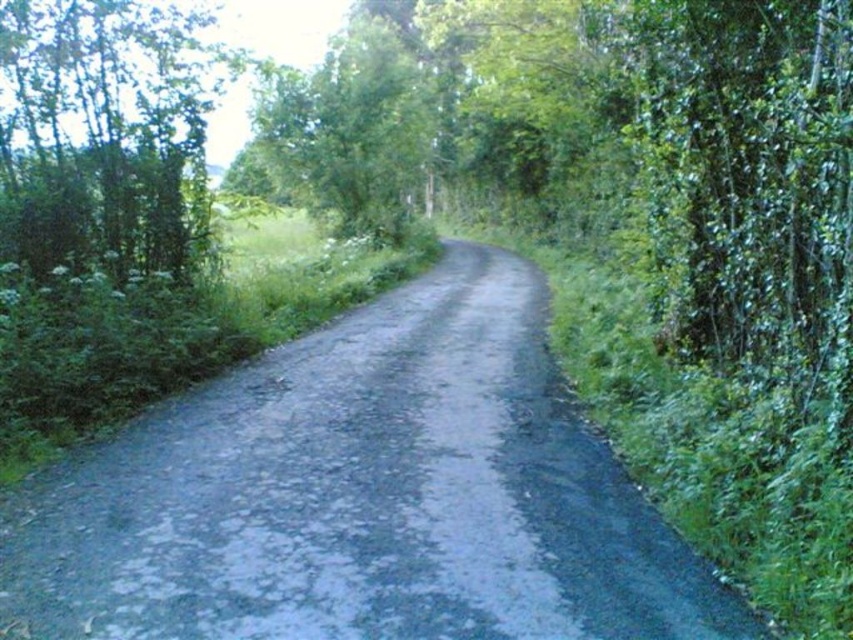
Question: Which point is farther from the camera taking this photo?

Choices:
 (A) (503, 580)
 (B) (157, 240)

Answer: (B)

Question: Can you confirm if gray asphalt road at center is positioned to the left of green leafy tree at left?

Choices:
 (A) yes
 (B) no

Answer: (B)

Question: Which of the following is the closest to the observer?

Choices:
 (A) (384, 582)
 (B) (39, 112)

Answer: (A)

Question: Observing the image, what is the correct spatial positioning of gray asphalt road at center in reference to green leafy tree at left?

Choices:
 (A) left
 (B) right

Answer: (B)

Question: Can you confirm if gray asphalt road at center is bigger than green leafy tree at left?

Choices:
 (A) no
 (B) yes

Answer: (A)